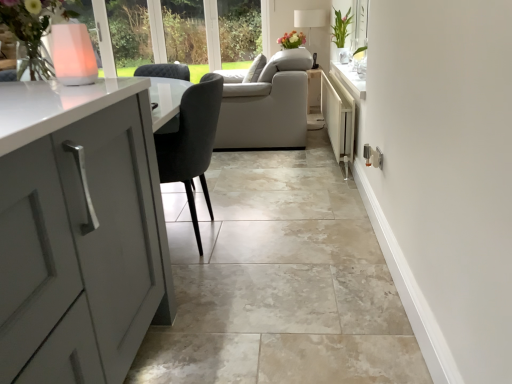
Question: Would you say white fabric lampshade at upper center is inside or outside pink translucent vase at upper left?

Choices:
 (A) outside
 (B) inside

Answer: (A)

Question: In terms of width, does white fabric lampshade at upper center look wider or thinner when compared to pink translucent vase at upper left?

Choices:
 (A) thin
 (B) wide

Answer: (B)

Question: Considering the real-world distances, which object is closest to the pink translucent vase at upper left?

Choices:
 (A) white fabric lampshade at upper center
 (B) white metallic radiator at center-right
 (C) beige marble tile at center
 (D) white glossy vase at upper right
 (E) matte pink flowers at upper center

Answer: (C)

Question: Estimate the real-world distances between objects in this image. Which object is closer to the matte pink flowers at upper center?

Choices:
 (A) white glossy vase at upper right
 (B) beige marble tile at center
 (C) pink translucent vase at upper left
 (D) white fabric lampshade at upper center
 (E) white metallic radiator at center-right

Answer: (D)